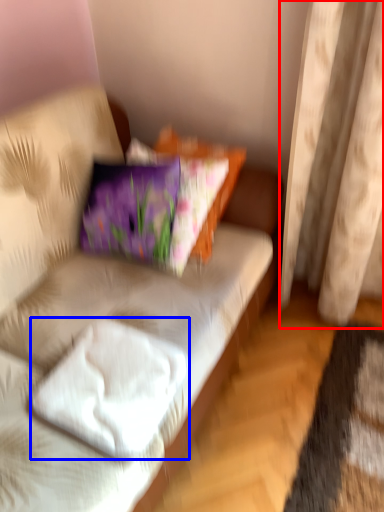
Question: Which object appears farthest to the camera in this image, curtain (highlighted by a red box) or pillow (highlighted by a blue box)?

Choices:
 (A) curtain
 (B) pillow

Answer: (A)